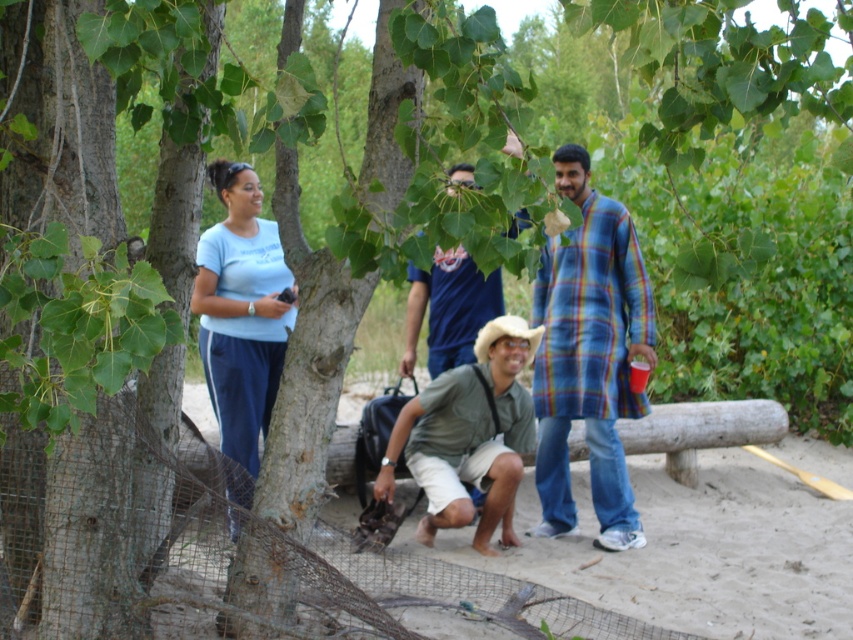
Can you confirm if light blue t-shirt at center is smaller than blue cotton shirt at center?

No, light blue t-shirt at center is not smaller than blue cotton shirt at center.

Is light blue t-shirt at center wider than blue cotton shirt at center?

No, light blue t-shirt at center is not wider than blue cotton shirt at center.

Locate an element on the screen. light blue t-shirt at center is located at coordinates (241, 317).

Does plaid cotton shirt at right have a greater width compared to light blue t-shirt at center?

Yes, plaid cotton shirt at right is wider than light blue t-shirt at center.

Looking at this image, measure the distance between point (628, 388) and camera.

A distance of 22.42 feet exists between point (628, 388) and camera.

Where is `plaid cotton shirt at right`? This screenshot has width=853, height=640. plaid cotton shirt at right is located at coordinates (589, 356).

Is green matte shirt at center taller than light blue t-shirt at center?

In fact, green matte shirt at center may be shorter than light blue t-shirt at center.

Is green matte shirt at center above light blue t-shirt at center?

Actually, green matte shirt at center is below light blue t-shirt at center.

Does point (502, 358) come in front of point (206, 269)?

No, (502, 358) is further to viewer.

The width and height of the screenshot is (853, 640). In order to click on green matte shirt at center in this screenshot , I will do `click(469, 436)`.